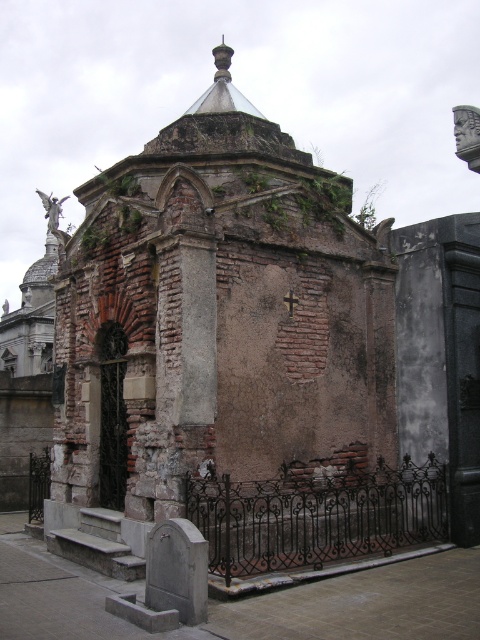
Is black wrought iron fence at lower center below black wrought iron fence at lower left?

Incorrect, black wrought iron fence at lower center is not positioned below black wrought iron fence at lower left.

This screenshot has width=480, height=640. What do you see at coordinates (316, 515) in the screenshot?
I see `black wrought iron fence at lower center` at bounding box center [316, 515].

Locate an element on the screen. black wrought iron fence at lower center is located at coordinates (316, 515).